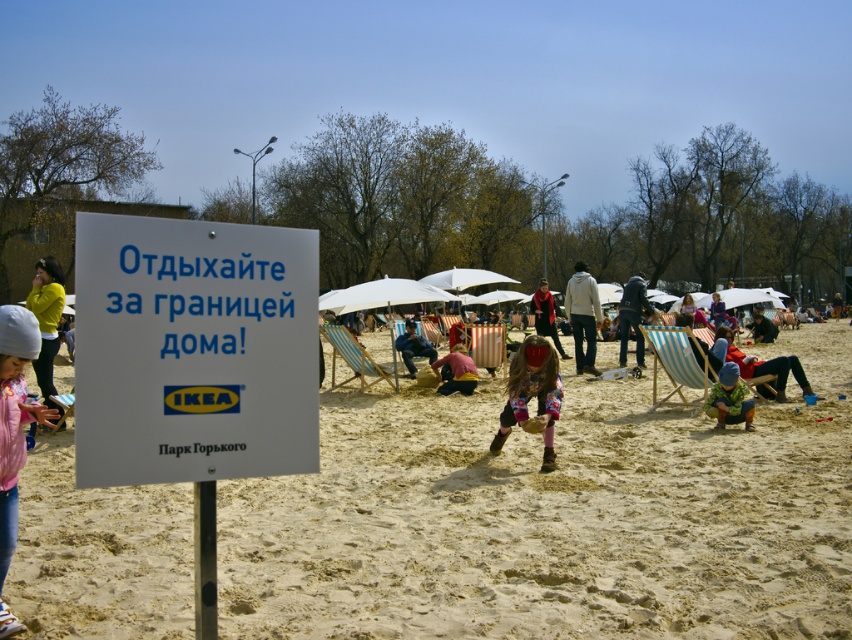
You are planning to set up a small picnic area in the park and have both the striped fabric beach chair at center and the blue striped chair at center available. Which chair would allow you to place more items around it without overcrowding the space?

The striped fabric beach chair at center occupies less space than the blue striped chair at center, so it would allow more items to be placed around it without overcrowding the space.

You are standing at the signpost and want to walk to both the point at coordinates point [534,316] and point [415,336]. Which point will you reach first?

You will reach point [415,336] first because it is closer to you than point [534,316], which is further away.